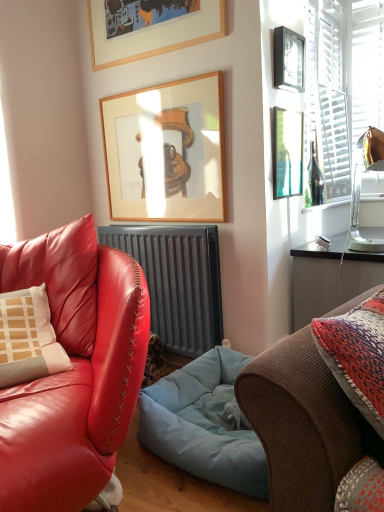
What is the approximate height of matte leather couch at center, placed as the second studio couch when sorted from right to left?

The height of matte leather couch at center, placed as the second studio couch when sorted from right to left, is 36.49 inches.

What do you see at coordinates (287, 153) in the screenshot? This screenshot has height=512, width=384. I see `green glass bottle at upper right, the fourth picture frame from the top` at bounding box center [287, 153].

The height and width of the screenshot is (512, 384). Find the location of `brown textured couch at right, which is the first studio couch from right to left`. brown textured couch at right, which is the first studio couch from right to left is located at coordinates (303, 424).

Locate an element on the screen. The width and height of the screenshot is (384, 512). wooden picture frame at upper center, placed as the first picture frame when sorted from top to bottom is located at coordinates (153, 33).

What do you see at coordinates (153, 33) in the screenshot? I see `wooden picture frame at upper center, placed as the first picture frame when sorted from top to bottom` at bounding box center [153, 33].

Locate an element on the screen. This screenshot has height=512, width=384. green glass bottle at upper right is located at coordinates (315, 178).

Where is `metallic gray radiator at center`? This screenshot has height=512, width=384. metallic gray radiator at center is located at coordinates (177, 281).

Would you say brown textured couch at right, the 2th studio couch in the left-to-right sequence, is inside or outside green glass bottle at upper right?

brown textured couch at right, the 2th studio couch in the left-to-right sequence, cannot be found inside green glass bottle at upper right.

Is point (305, 398) positioned after point (310, 179)?

No, it is not.

From a real-world perspective, is brown textured couch at right, the 2th studio couch in the left-to-right sequence, positioned above or below green glass bottle at upper right?

In terms of real-world spatial position, brown textured couch at right, the 2th studio couch in the left-to-right sequence, is below green glass bottle at upper right.

In the scene shown: Considering the relative sizes of brown textured couch at right, the 2th studio couch in the left-to-right sequence, and green glass bottle at upper right in the image provided, is brown textured couch at right, the 2th studio couch in the left-to-right sequence, smaller than green glass bottle at upper right?

No, brown textured couch at right, the 2th studio couch in the left-to-right sequence, is not smaller than green glass bottle at upper right.

From the picture: Can you confirm if metallic gray radiator at center is taller than matte black picture frame at upper right, the third picture frame ordered from the bottom?

Indeed, metallic gray radiator at center has a greater height compared to matte black picture frame at upper right, the third picture frame ordered from the bottom.

Which is more to the left, metallic gray radiator at center or matte black picture frame at upper right, the second picture frame in the top-to-bottom sequence?

metallic gray radiator at center is more to the left.

From the picture: Can you confirm if metallic gray radiator at center is smaller than matte black picture frame at upper right, the third picture frame ordered from the bottom?

Incorrect, metallic gray radiator at center is not smaller in size than matte black picture frame at upper right, the third picture frame ordered from the bottom.

Is metallic gray radiator at center facing towards matte black picture frame at upper right, the second picture frame in the top-to-bottom sequence?

No, metallic gray radiator at center is not turned towards matte black picture frame at upper right, the second picture frame in the top-to-bottom sequence.

Is matte black picture frame at upper right, the third picture frame ordered from the bottom, in contact with wooden picture frame at upper center, which appears as the third picture frame when viewed from the top?

No, matte black picture frame at upper right, the third picture frame ordered from the bottom, is not touching wooden picture frame at upper center, which appears as the third picture frame when viewed from the top.

Is matte black picture frame at upper right, the third picture frame ordered from the bottom, turned away from wooden picture frame at upper center, which appears as the third picture frame when viewed from the top?

That's not correct — matte black picture frame at upper right, the third picture frame ordered from the bottom, is not looking away from wooden picture frame at upper center, which appears as the third picture frame when viewed from the top.

Considering the relative sizes of matte black picture frame at upper right, the second picture frame in the top-to-bottom sequence, and wooden picture frame at upper center, arranged as the 2th picture frame when ordered from the bottom, in the image provided, is matte black picture frame at upper right, the second picture frame in the top-to-bottom sequence, taller than wooden picture frame at upper center, arranged as the 2th picture frame when ordered from the bottom,?

Incorrect, the height of matte black picture frame at upper right, the second picture frame in the top-to-bottom sequence, is not larger of that of wooden picture frame at upper center, arranged as the 2th picture frame when ordered from the bottom.

Is matte black picture frame at upper right, the second picture frame in the top-to-bottom sequence, at the left side of wooden picture frame at upper center, which appears as the third picture frame when viewed from the top?

No, matte black picture frame at upper right, the second picture frame in the top-to-bottom sequence, is not to the left of wooden picture frame at upper center, which appears as the third picture frame when viewed from the top.

What's the angular difference between metallic gray radiator at center and green glass bottle at upper right's facing directions?

There is a 90.1-degree angle between the facing directions of metallic gray radiator at center and green glass bottle at upper right.

Image resolution: width=384 pixels, height=512 pixels. I want to click on wine bottle lying on the right of metallic gray radiator at center, so [x=315, y=178].

Which is more to the right, metallic gray radiator at center or green glass bottle at upper right?

green glass bottle at upper right.

Is metallic gray radiator at center turned away from green glass bottle at upper right?

Yes, metallic gray radiator at center is facing away from green glass bottle at upper right.

Between wooden picture frame at upper center, which appears as the third picture frame when viewed from the top, and brown textured couch at right, the 2th studio couch in the left-to-right sequence, which one is positioned in front?

brown textured couch at right, the 2th studio couch in the left-to-right sequence, is closer to the camera.

From the image's perspective, which is above, wooden picture frame at upper center, arranged as the 2th picture frame when ordered from the bottom, or brown textured couch at right, the 2th studio couch in the left-to-right sequence?

From the image's view, wooden picture frame at upper center, arranged as the 2th picture frame when ordered from the bottom, is above.

From the picture: Is wooden picture frame at upper center, which appears as the third picture frame when viewed from the top, spatially inside brown textured couch at right, which is the first studio couch from right to left, or outside of it?

wooden picture frame at upper center, which appears as the third picture frame when viewed from the top, is not inside brown textured couch at right, which is the first studio couch from right to left, it's outside.

Looking at the image, does wooden picture frame at upper center, arranged as the 2th picture frame when ordered from the bottom, seem bigger or smaller compared to brown textured couch at right, which is the first studio couch from right to left?

Clearly, wooden picture frame at upper center, arranged as the 2th picture frame when ordered from the bottom, is smaller in size than brown textured couch at right, which is the first studio couch from right to left.

The height and width of the screenshot is (512, 384). In order to click on the 2nd studio couch below the metallic gold lampshade at upper right (from a real-world perspective) in this screenshot , I will do `click(73, 370)`.

From a real-world perspective, which object rests below the other?

From a 3D spatial view, matte leather couch at center, placed as the second studio couch when sorted from right to left, is below.

From the image's perspective, is matte leather couch at center, the first studio couch in the left-to-right sequence, located above or below metallic gold lampshade at upper right?

matte leather couch at center, the first studio couch in the left-to-right sequence, is situated lower than metallic gold lampshade at upper right in the image.

Is matte leather couch at center, placed as the second studio couch when sorted from right to left, not within metallic gold lampshade at upper right?

Yes, matte leather couch at center, placed as the second studio couch when sorted from right to left, is outside of metallic gold lampshade at upper right.

Is metallic gold lampshade at upper right taller than metallic gray radiator at center?

No, metallic gold lampshade at upper right is not taller than metallic gray radiator at center.

Where is `radiator on the left of the metallic gold lampshade at upper right`? This screenshot has width=384, height=512. radiator on the left of the metallic gold lampshade at upper right is located at coordinates (177, 281).

From a real-world perspective, is metallic gold lampshade at upper right positioned above or below metallic gray radiator at center?

metallic gold lampshade at upper right is above metallic gray radiator at center.

Is metallic gold lampshade at upper right positioned with its back to metallic gray radiator at center?

No, metallic gold lampshade at upper right is not facing away from metallic gray radiator at center.

Locate an element on the screen. The height and width of the screenshot is (512, 384). the 1st studio couch positioned below the green glass bottle at upper right (from a real-world perspective) is located at coordinates (303, 424).

The height and width of the screenshot is (512, 384). In order to click on radiator to the left of matte black picture frame at upper right, the second picture frame in the top-to-bottom sequence in this screenshot , I will do `click(177, 281)`.

When comparing their distances from metallic gold lampshade at upper right, does green glass bottle at upper right or wooden picture frame at upper center, placed as the fourth picture frame when sorted from bottom to top, seem closer?

Based on the image, green glass bottle at upper right appears to be nearer to metallic gold lampshade at upper right.

Estimate the real-world distances between objects in this image. Which object is further from wooden picture frame at upper center, placed as the first picture frame when sorted from top to bottom, wooden picture frame at upper center, arranged as the 2th picture frame when ordered from the bottom, or green glass bottle at upper right, the first picture frame from the bottom?

The object further to wooden picture frame at upper center, placed as the first picture frame when sorted from top to bottom, is green glass bottle at upper right, the first picture frame from the bottom.

Considering their positions, is brown textured couch at right, which is the first studio couch from right to left, positioned further to matte black picture frame at upper right, the second picture frame in the top-to-bottom sequence, than metallic gray radiator at center?

brown textured couch at right, which is the first studio couch from right to left, is positioned further to the anchor matte black picture frame at upper right, the second picture frame in the top-to-bottom sequence.

Considering their positions, is wooden picture frame at upper center, placed as the fourth picture frame when sorted from bottom to top, positioned further to green glass bottle at upper right than green glass bottle at upper right, the first picture frame from the bottom?

The object further to green glass bottle at upper right is wooden picture frame at upper center, placed as the fourth picture frame when sorted from bottom to top.

Considering their positions, is wooden picture frame at upper center, placed as the fourth picture frame when sorted from bottom to top, positioned closer to metallic gray radiator at center than wooden picture frame at upper center, which appears as the third picture frame when viewed from the top?

Among the two, wooden picture frame at upper center, which appears as the third picture frame when viewed from the top, is located nearer to metallic gray radiator at center.

Considering their positions, is brown textured couch at right, which is the first studio couch from right to left, positioned further to metallic gold lampshade at upper right than matte leather couch at center, the first studio couch in the left-to-right sequence?

brown textured couch at right, which is the first studio couch from right to left.

Looking at the image, which one is located closer to matte leather couch at center, placed as the second studio couch when sorted from right to left, green glass bottle at upper right, the fourth picture frame from the top, or wooden picture frame at upper center, placed as the first picture frame when sorted from top to bottom?

Among the two, green glass bottle at upper right, the fourth picture frame from the top, is located nearer to matte leather couch at center, placed as the second studio couch when sorted from right to left.

Looking at the image, which one is located closer to metallic gold lampshade at upper right, metallic gray radiator at center or matte leather couch at center, placed as the second studio couch when sorted from right to left?

metallic gray radiator at center is positioned closer to the anchor metallic gold lampshade at upper right.

Locate an element on the screen. wine bottle between wooden picture frame at upper center, placed as the fourth picture frame when sorted from bottom to top, and matte leather couch at center, the first studio couch in the left-to-right sequence, in the up-down direction is located at coordinates (315, 178).

The image size is (384, 512). What are the coordinates of `radiator between brown textured couch at right, which is the first studio couch from right to left, and green glass bottle at upper right from front to back` in the screenshot? It's located at (177, 281).

At what (x,y) coordinates should I click in order to perform the action: click on studio couch located between brown textured couch at right, the 2th studio couch in the left-to-right sequence, and green glass bottle at upper right in the depth direction. Please return your answer as a coordinate pair (x, y). The width and height of the screenshot is (384, 512). Looking at the image, I should click on (73, 370).

You are a GUI agent. You are given a task and a screenshot of the screen. Output one action in this format:
    pyautogui.click(x=<x>, y=<y>)
    Task: Click on the studio couch between brown textured couch at right, the 2th studio couch in the left-to-right sequence, and wooden picture frame at upper center, arranged as the 2th picture frame when ordered from the bottom, from front to back
    The height and width of the screenshot is (512, 384).
    Given the screenshot: What is the action you would take?
    pyautogui.click(x=73, y=370)